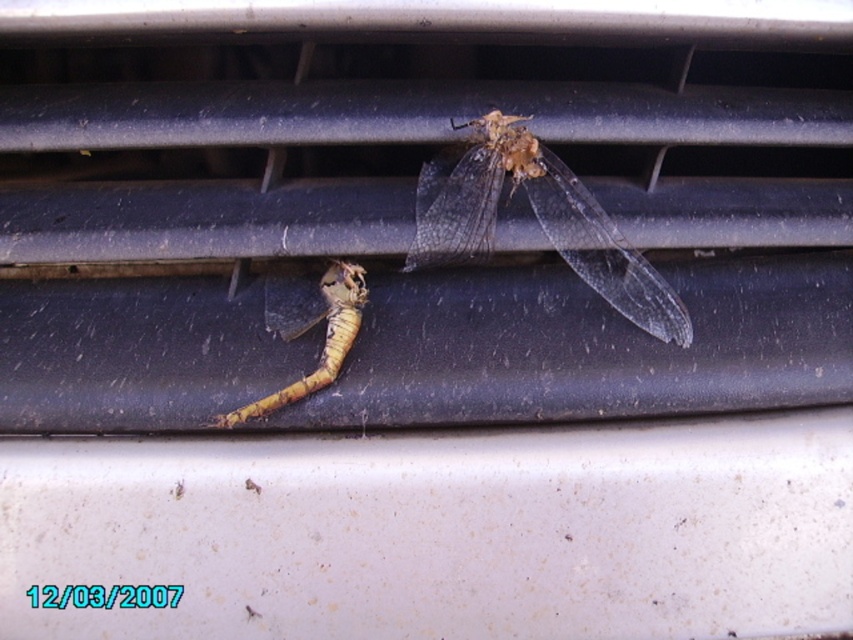
You are a maintenance worker inspecting the air conditioning grill. You notice two points marked on the grill. Which point is closer to your face when you look at the grill? The points are point [422,193] and point [350,264].

Point [422,193] is further to the viewer than point [350,264], so the point closer to your face would be point [422,193].